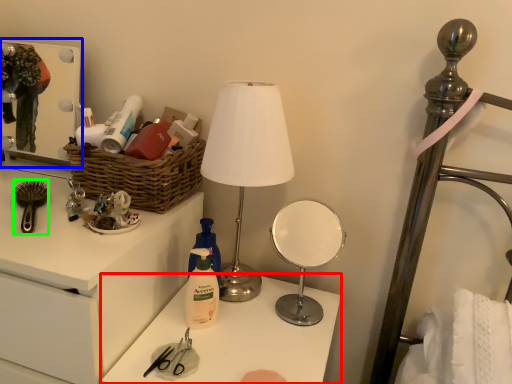
Question: Considering the real-world distances, which object is closest to table (highlighted by a red box)? medicine cabinet (highlighted by a blue box) or brush (highlighted by a green box).

Choices:
 (A) medicine cabinet
 (B) brush

Answer: (B)